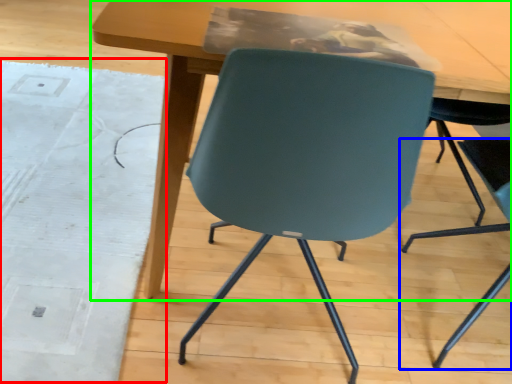
Question: Based on their relative distances, which object is nearer to mat (highlighted by a red box)? Choose from chair (highlighted by a blue box) and table (highlighted by a green box).

Choices:
 (A) chair
 (B) table

Answer: (B)